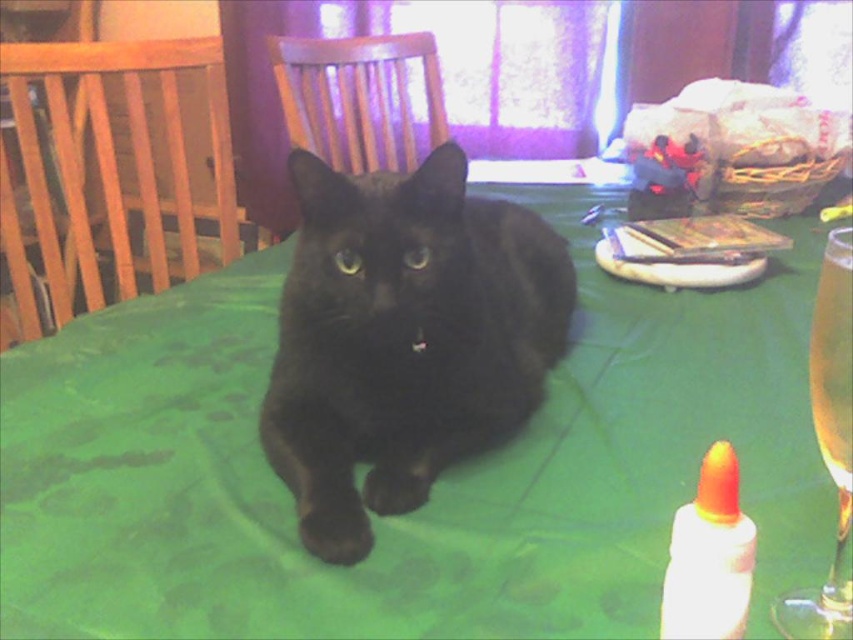
You are a photographer trying to capture a clear shot of the black glossy cat at center and the translucent glass wine at right. Since you want both subjects in focus, you need to know their distance relationship. Which object is closer to you?

The black glossy cat at center is closer to you than the translucent glass wine at right.

You are a photographer trying to capture a closeup of the black glossy cat at center and the white glossy glue bottle at lower right. Which object should you focus on first if you want to ensure both are in focus without adjusting the camera settings?

The black glossy cat at center is further to the viewer than the white glossy glue bottle at lower right, so you should focus on the black glossy cat at center first to ensure both are in focus.